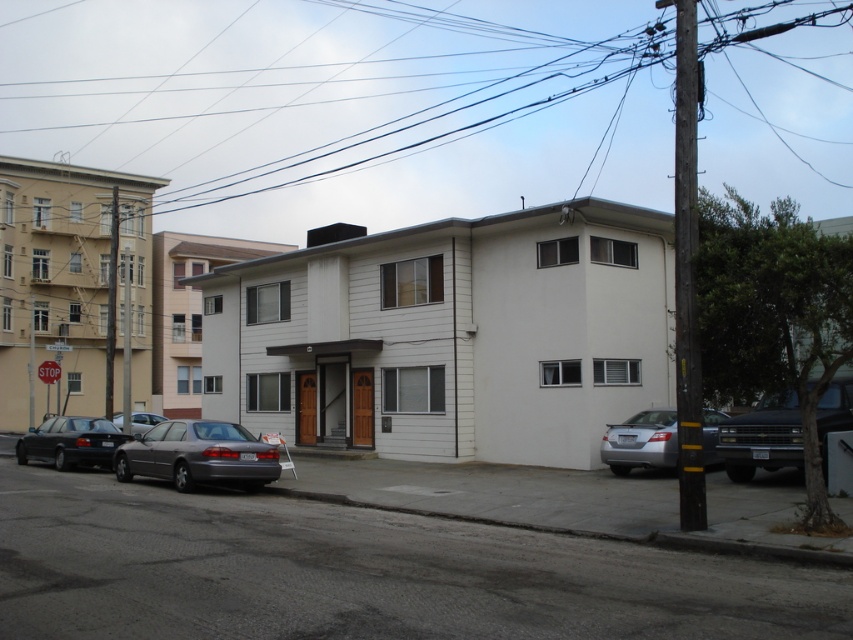
Does point (618, 468) lie in front of point (132, 412)?

Yes, point (618, 468) is in front of point (132, 412).

In the scene shown: Does silver metallic sedan at lower right have a larger size compared to silver metallic sedan at lower left?

Incorrect, silver metallic sedan at lower right is not larger than silver metallic sedan at lower left.

Where is `silver metallic sedan at lower right`? Image resolution: width=853 pixels, height=640 pixels. silver metallic sedan at lower right is located at coordinates (641, 442).

Which is in front, point (621, 428) or point (61, 428)?

Point (621, 428) is in front.

Does point (619, 442) lie in front of point (20, 452)?

Yes.

This screenshot has height=640, width=853. Find the location of `silver metallic sedan at lower right`. silver metallic sedan at lower right is located at coordinates (641, 442).

Does black glossy sedan at right appear under silver metallic sedan at lower left?

No.

Find the location of a particular element. This screenshot has width=853, height=640. black glossy sedan at right is located at coordinates (762, 436).

In order to click on black glossy sedan at right in this screenshot , I will do `click(762, 436)`.